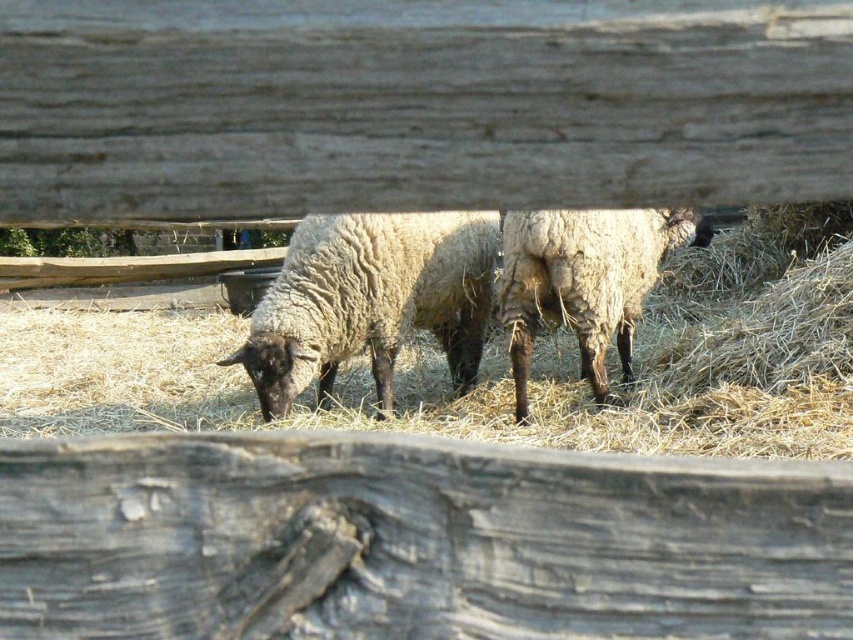
Question: Which object appears farthest from the camera in this image?

Choices:
 (A) fuzzy white sheep at center
 (B) fuzzy woolly sheep at center
 (C) light brown straw at center

Answer: (C)

Question: Based on their relative distances, which object is nearer to the fuzzy woolly sheep at center?

Choices:
 (A) light brown straw at center
 (B) fuzzy white sheep at center

Answer: (A)

Question: In this image, where is light brown straw at center located relative to fuzzy white sheep at center?

Choices:
 (A) left
 (B) right

Answer: (B)

Question: Does light brown straw at center appear on the right side of fuzzy woolly sheep at center?

Choices:
 (A) no
 (B) yes

Answer: (A)

Question: Among these points, which one is farthest from the camera?

Choices:
 (A) (654, 314)
 (B) (358, 234)
 (C) (631, 266)

Answer: (A)

Question: Is the position of fuzzy white sheep at center more distant than that of fuzzy woolly sheep at center?

Choices:
 (A) no
 (B) yes

Answer: (B)